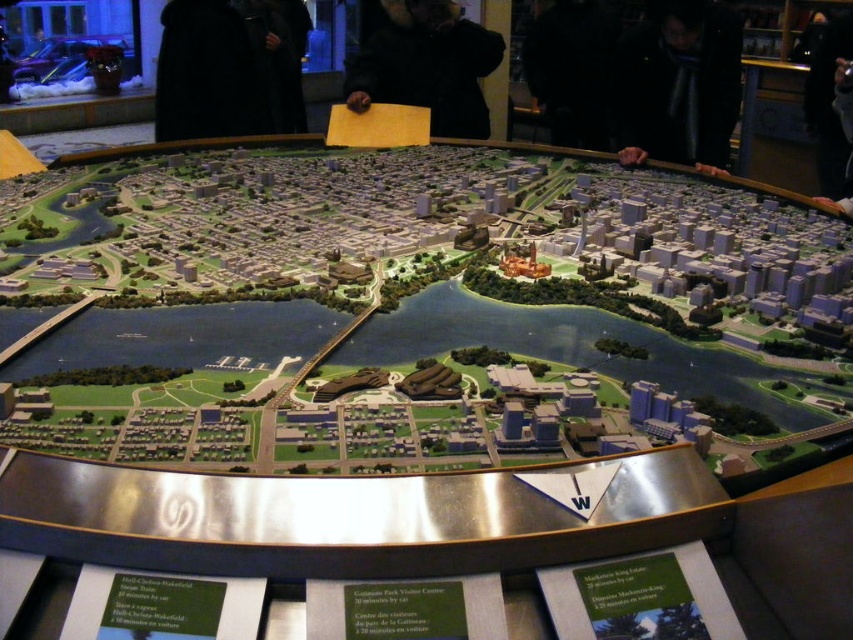
You are a visitor at a museum exhibition and notice two coats displayed on a mannequin in the center of the scene. The coats are labeled as the black matte jacket at upper center and the black fuzzy coat at upper center. Which coat is closer to the ground?

The black matte jacket at upper center is closer to the ground because it is positioned under the black fuzzy coat at upper center.

You are a security guard in the exhibition hall where the city model is displayed. You notice a black matte jacket at upper center in the image. Where exactly is the black matte jacket located in the model? Please provide coordinates in the format of a point with two decimal places.

The black matte jacket at upper center is located at point coordinates of (679, 83).